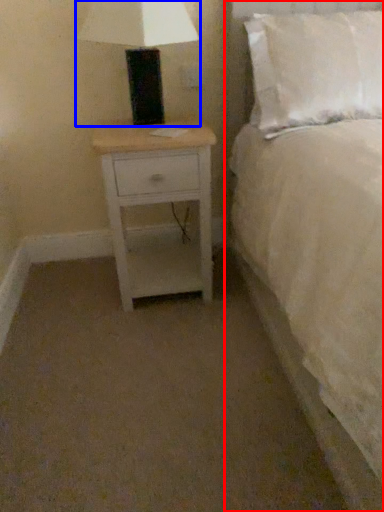
Question: Which object appears farthest to the camera in this image, bed (highlighted by a red box) or table lamp (highlighted by a blue box)?

Choices:
 (A) bed
 (B) table lamp

Answer: (B)